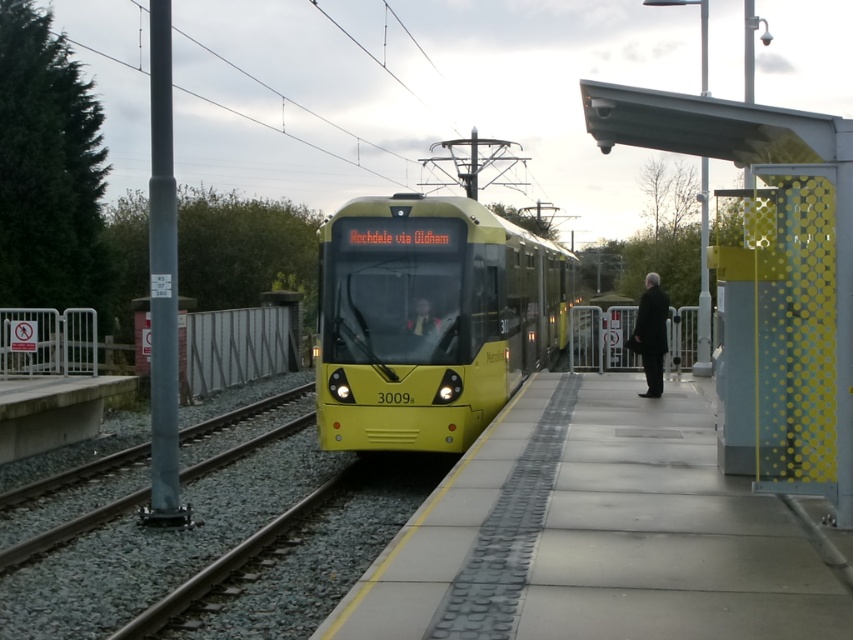
You are a passenger waiting at the tram station. You notice a yellow metallic train at center and a black wool coat at right. Which object is taller?

The yellow metallic train at center is taller than the black wool coat at right.

You are a delivery person with a 1.2 meter wide cart. You need to move from the black wool coat at right to the smooth concrete platform at center. Can your cart fit through the space between them?

The smooth concrete platform at center is thinner than black wool coat at right. Since the platform is thinner, the space between them may be narrower than 1.2 meters. Therefore, the cart might not fit through the space between the black wool coat at right and the smooth concrete platform at center.

You are a passenger waiting at the tram station. You need to board the yellow metallic train at center, but there is a black wool coat at right blocking the entrance. Can you estimate if the train is wider than the coat?

The yellow metallic train at center is wider than the black wool coat at right, so you can board the train by moving around the coat since the train is wider.